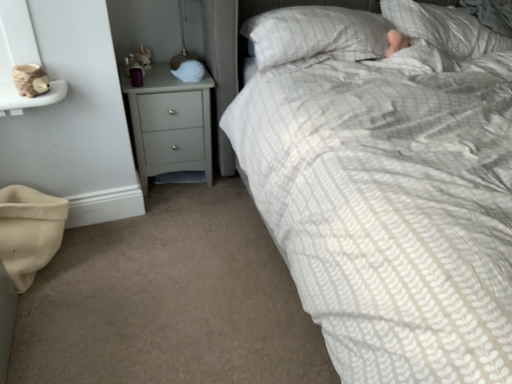
Question: From the image's perspective, is matte gray chest of drawers at center-left over white textured pillow at upper center, arranged as the 1th pillow when viewed from the left?

Choices:
 (A) no
 (B) yes

Answer: (A)

Question: Is white textured pillow at upper center, arranged as the 1th pillow when viewed from the left, at the back of matte gray chest of drawers at center-left?

Choices:
 (A) yes
 (B) no

Answer: (B)

Question: Is matte gray chest of drawers at center-left taller than white textured pillow at upper center, positioned as the 2th pillow in right-to-left order?

Choices:
 (A) yes
 (B) no

Answer: (A)

Question: Can you confirm if matte gray chest of drawers at center-left is thinner than white textured pillow at upper center, positioned as the 2th pillow in right-to-left order?

Choices:
 (A) yes
 (B) no

Answer: (A)

Question: Does matte gray chest of drawers at center-left have a lesser height compared to white textured pillow at upper center, positioned as the 2th pillow in right-to-left order?

Choices:
 (A) yes
 (B) no

Answer: (B)

Question: Considering the positions of white textured pillow at upper center, positioned as the 2th pillow in right-to-left order, and white textured pillow at upper right, positioned as the second pillow in left-to-right order, in the image, is white textured pillow at upper center, positioned as the 2th pillow in right-to-left order, bigger or smaller than white textured pillow at upper right, positioned as the second pillow in left-to-right order,?

Choices:
 (A) big
 (B) small

Answer: (B)

Question: Is white textured pillow at upper center, arranged as the 1th pillow when viewed from the left, inside the boundaries of white textured pillow at upper right, arranged as the first pillow when viewed from the right, or outside?

Choices:
 (A) outside
 (B) inside

Answer: (A)

Question: Is point (375, 46) closer or farther from the camera than point (478, 34)?

Choices:
 (A) farther
 (B) closer

Answer: (B)

Question: Is white textured pillow at upper center, positioned as the 2th pillow in right-to-left order, to the left or to the right of white textured pillow at upper right, arranged as the first pillow when viewed from the right, in the image?

Choices:
 (A) right
 (B) left

Answer: (B)

Question: Considering their positions, is white textured pillow at upper right, positioned as the second pillow in left-to-right order, located in front of or behind matte gray chest of drawers at center-left?

Choices:
 (A) front
 (B) behind

Answer: (A)

Question: Visually, is white textured pillow at upper right, positioned as the second pillow in left-to-right order, positioned to the left or to the right of matte gray chest of drawers at center-left?

Choices:
 (A) left
 (B) right

Answer: (B)

Question: Considering the positions of white textured pillow at upper right, arranged as the first pillow when viewed from the right, and matte gray chest of drawers at center-left in the image, is white textured pillow at upper right, arranged as the first pillow when viewed from the right, taller or shorter than matte gray chest of drawers at center-left?

Choices:
 (A) short
 (B) tall

Answer: (A)

Question: Is white textured pillow at upper right, positioned as the second pillow in left-to-right order, inside the boundaries of matte gray chest of drawers at center-left, or outside?

Choices:
 (A) inside
 (B) outside

Answer: (B)

Question: From the image's perspective, is matte gray chest of drawers at center-left above or below white textured pillow at upper right, positioned as the second pillow in left-to-right order?

Choices:
 (A) below
 (B) above

Answer: (A)

Question: Is matte gray chest of drawers at center-left inside or outside of white textured pillow at upper right, positioned as the second pillow in left-to-right order?

Choices:
 (A) inside
 (B) outside

Answer: (B)